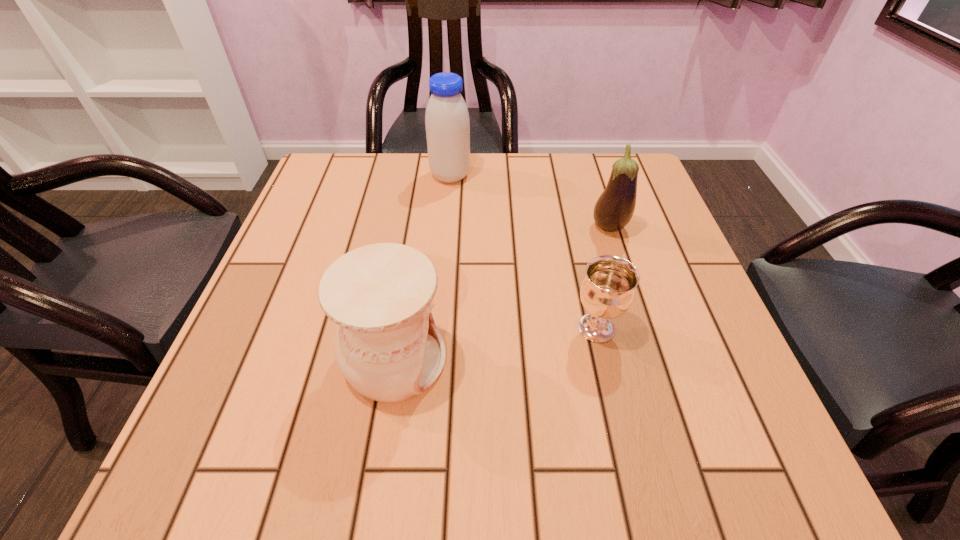
You are a GUI agent. You are given a task and a screenshot of the screen. Output one action in this format:
    pyautogui.click(x=<x>, y=<y>)
    Task: Click on the free region that satisfies the following two spatial constraints: 1. on the back side of the eggplant; 2. on the right side of the shortest object
    The width and height of the screenshot is (960, 540).
    Given the screenshot: What is the action you would take?
    pyautogui.click(x=573, y=228)